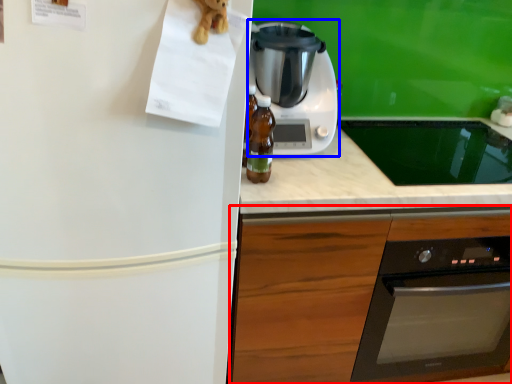
Question: Which point is further to the camera, cabinetry (highlighted by a red box) or kitchen appliance (highlighted by a blue box)?

Choices:
 (A) cabinetry
 (B) kitchen appliance

Answer: (B)